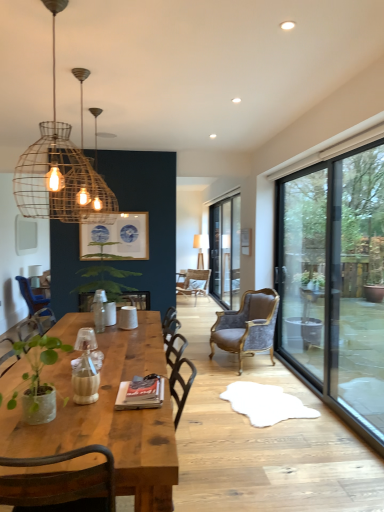
Question: Relative to rustic wire pendant light at upper left, is green matte plant at lower left, the first houseplant from the front, in front or behind?

Choices:
 (A) behind
 (B) front

Answer: (B)

Question: Based on their sizes in the image, would you say green matte plant at lower left, the first houseplant from the front, is bigger or smaller than rustic wire pendant light at upper left?

Choices:
 (A) big
 (B) small

Answer: (B)

Question: Which is farther from the green matte plant at lower left, the first houseplant from the front?

Choices:
 (A) velvet brown armchair at center, the first chair from the back
 (B) wooden table at center
 (C) white matte cup at center
 (D) blue fabric chair at left, the 2th chair in the back-to-front sequence
 (E) blue paper picture frame at upper center

Answer: (A)

Question: Based on their relative distances, which object is farther from the blue fabric chair at left, the 2th chair in the back-to-front sequence?

Choices:
 (A) green leafy plant at center, the 2th houseplant viewed from the front
 (B) green matte plant at lower left, which is the second houseplant from back to front
 (C) velvet brown armchair at center, the first chair from the right
 (D) transparent glass door at center
 (E) rustic wire pendant light at upper left

Answer: (D)